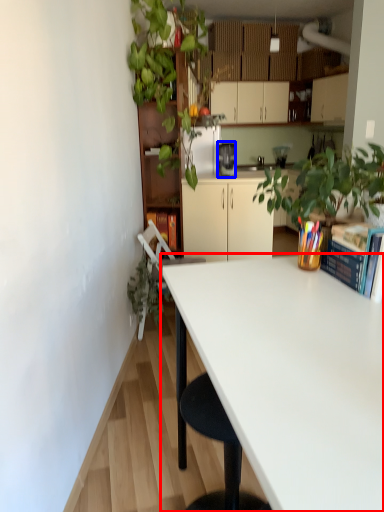
Question: Which point is further to the camera, desk (highlighted by a red box) or coffee maker (highlighted by a blue box)?

Choices:
 (A) desk
 (B) coffee maker

Answer: (B)